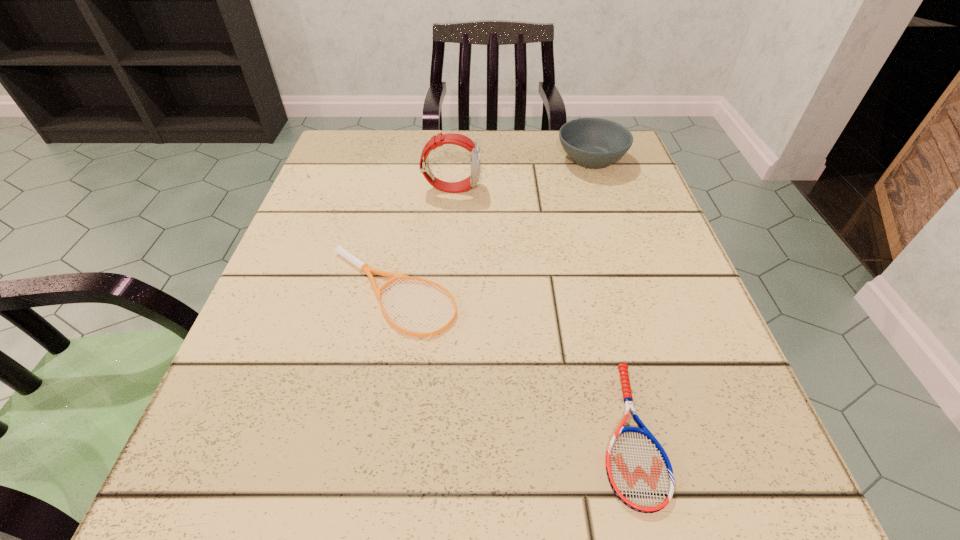
Where is `vacant space at the right edge`? Image resolution: width=960 pixels, height=540 pixels. vacant space at the right edge is located at coordinates (638, 241).

Locate an element on the screen. Image resolution: width=960 pixels, height=540 pixels. vacant area at the far right corner of the desktop is located at coordinates (635, 161).

Find the location of a particular element. The width and height of the screenshot is (960, 540). free space at the near right corner of the desktop is located at coordinates (766, 511).

Identify the location of vacant space in between the shorter tennis racket and the third shortest object. The image size is (960, 540). (610, 295).

Find the location of a particular element. This screenshot has height=540, width=960. vacant point located between the second tallest object and the shortest object is located at coordinates (610, 295).

Find the location of a particular element. free area in between the watch and the third tallest object is located at coordinates (423, 241).

The height and width of the screenshot is (540, 960). Find the location of `vacant area that lies between the nearest object and the soup bowl`. vacant area that lies between the nearest object and the soup bowl is located at coordinates [x=610, y=295].

Where is `free space between the farther tennis racket and the watch`? free space between the farther tennis racket and the watch is located at coordinates (423, 241).

Find the location of `vacant space that's between the farther tennis racket and the nearer tennis racket`. vacant space that's between the farther tennis racket and the nearer tennis racket is located at coordinates (x=512, y=363).

You are a GUI agent. You are given a task and a screenshot of the screen. Output one action in this format:
    pyautogui.click(x=<x>, y=<y>)
    Task: Click on the vacant region between the shorter tennis racket and the tallest object
    
    Given the screenshot: What is the action you would take?
    pyautogui.click(x=540, y=310)